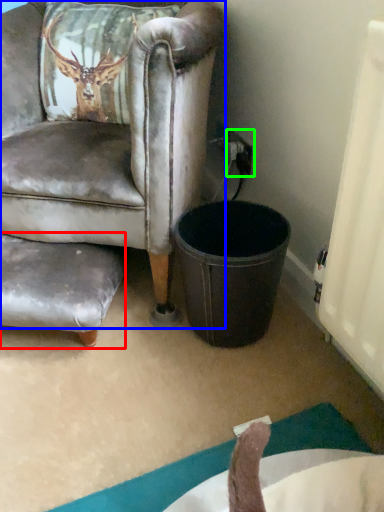
Question: Considering the real-world distances, which object is farthest from swivel chair (highlighted by a red box)? chair (highlighted by a blue box) or power outlet (highlighted by a green box)?

Choices:
 (A) chair
 (B) power outlet

Answer: (B)